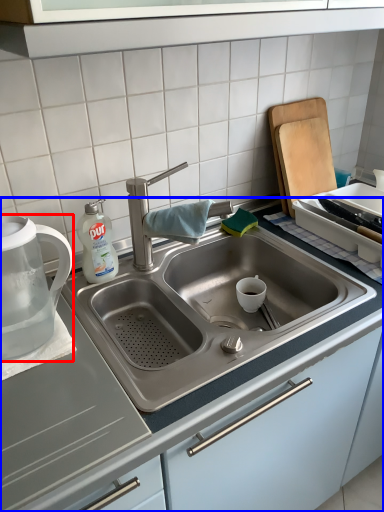
Question: Among these objects, which one is farthest to the camera, tea pot (highlighted by a red box) or countertop (highlighted by a blue box)?

Choices:
 (A) tea pot
 (B) countertop

Answer: (A)